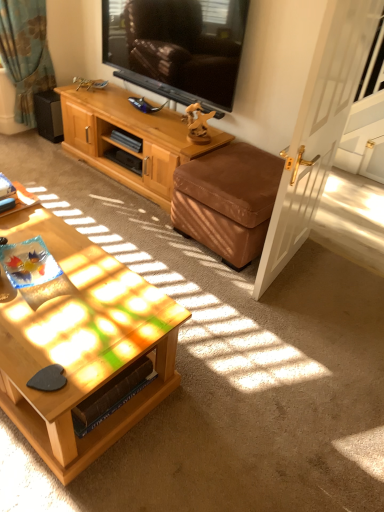
Where is `vacant region above woodenobject at lower left (from a real-world perspective)`? This screenshot has width=384, height=512. vacant region above woodenobject at lower left (from a real-world perspective) is located at coordinates (52, 280).